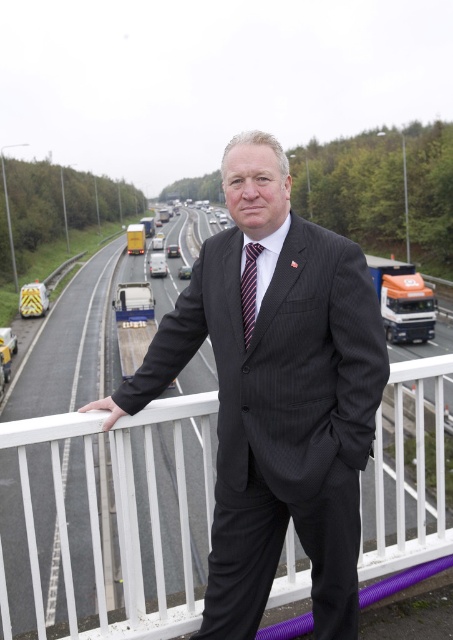
You are a tailor measuring the width of objects for a project. You have a white metal railing at center and a striped fabric tie at center in front of you. Which object is wider?

The white metal railing at center is wider than the striped fabric tie at center.

You are a fashion photographer observing a man in a black pinstripe suit at center and a striped fabric tie at center. Which item is positioned closer to your camera lens?

The black pinstripe suit at center is closer to the viewer than the striped fabric tie at center, so the black pinstripe suit at center would be closer to the camera lens.

You are a fashion designer observing a man dressed in a black pinstripe suit at center and a striped fabric tie at center. Which clothing item is larger in size?

The black pinstripe suit at center is bigger than the striped fabric tie at center.